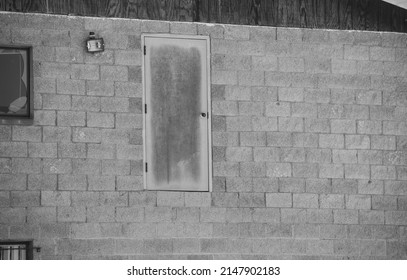
The width and height of the screenshot is (407, 280). Identify the location of door. (195, 134).